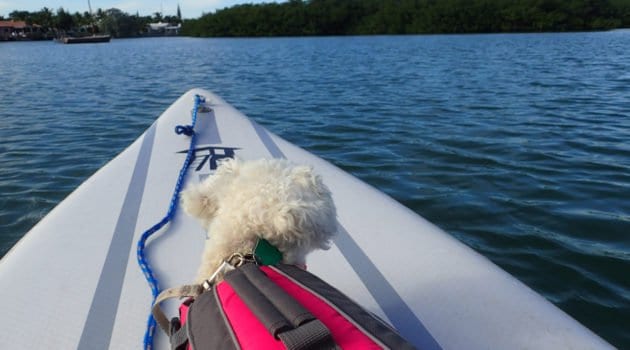
Find the location of a particular element. board is located at coordinates coord(101,221).